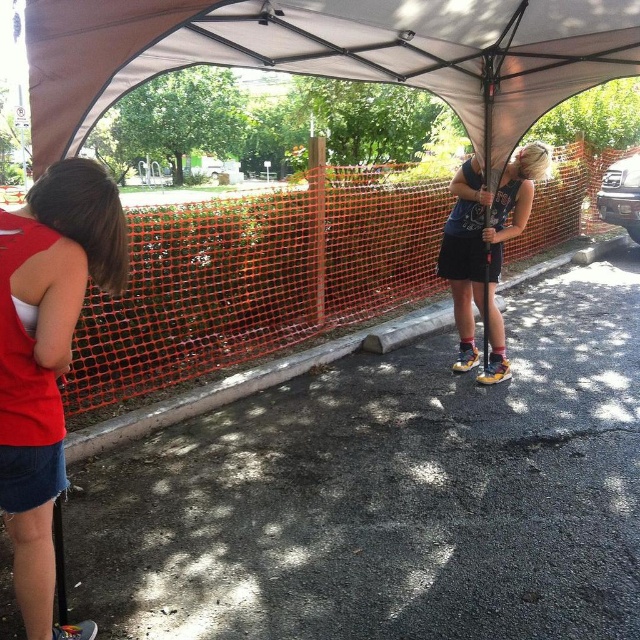
Can you confirm if brown fabric tent at upper center is smaller than gray fabric canopy at upper center?

Yes.

In the scene shown: Which is more to the right, brown fabric tent at upper center or gray fabric canopy at upper center?

brown fabric tent at upper center

Who is more distant from viewer, (332, 68) or (122, 6)?

Point (332, 68)

You are a GUI agent. You are given a task and a screenshot of the screen. Output one action in this format:
    pyautogui.click(x=<x>, y=<y>)
    Task: Click on the brown fabric tent at upper center
    The width and height of the screenshot is (640, 640).
    Given the screenshot: What is the action you would take?
    pyautogui.click(x=330, y=52)

Can you confirm if denim shorts at left is smaller than matte blue tank top at center?

Yes.

Which is above, denim shorts at left or matte blue tank top at center?

matte blue tank top at center

Does point (42, 408) come closer to viewer compared to point (460, 269)?

Yes, it is in front of point (460, 269).

This screenshot has height=640, width=640. Find the location of `denim shorts at left`. denim shorts at left is located at coordinates (48, 356).

The height and width of the screenshot is (640, 640). I want to click on gray fabric canopy at upper center, so click(x=330, y=52).

Which is behind, point (456, 26) or point (452, 289)?

Point (452, 289)

Between point (497, 35) and point (524, 198), which one is positioned in front?

Positioned in front is point (497, 35).

I want to click on gray fabric canopy at upper center, so 330,52.